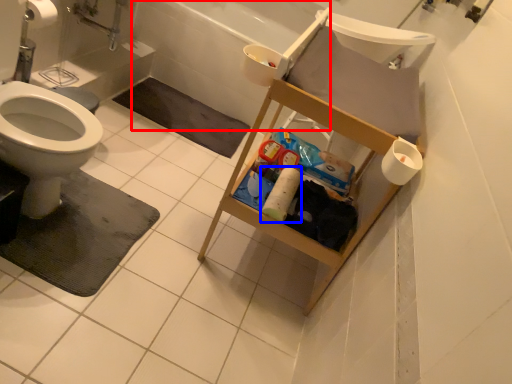
Question: Among these objects, which one is nearest to the camera, bath (highlighted by a red box) or toilet paper (highlighted by a blue box)?

Choices:
 (A) bath
 (B) toilet paper

Answer: (B)